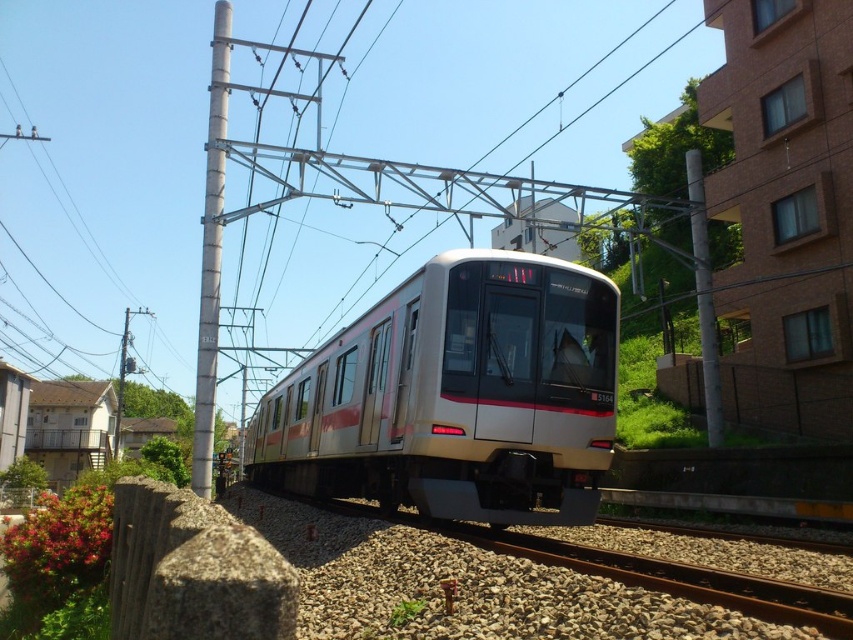
You are a pedestrian standing on the platform waiting for the train. You see the silver metallic train at center and the metallic gray pole at upper center. Which object is nearer to you?

The silver metallic train at center is closer to the viewer than the metallic gray pole at upper center.

You are a city planner analyzing the layout of this area. Given the silver metallic train at center and the metallic gray pole at left, which object takes up more area in the image?

The metallic gray pole at left takes up more area in the image than the silver metallic train at center.

You are a passenger on the electric train and looking out the window. You notice two metallic gray poles outside. Which one is higher from the ground, the metallic gray pole at left or the metallic gray pole at upper center?

The metallic gray pole at left is located above the metallic gray pole at upper center, so the metallic gray pole at left is higher from the ground.